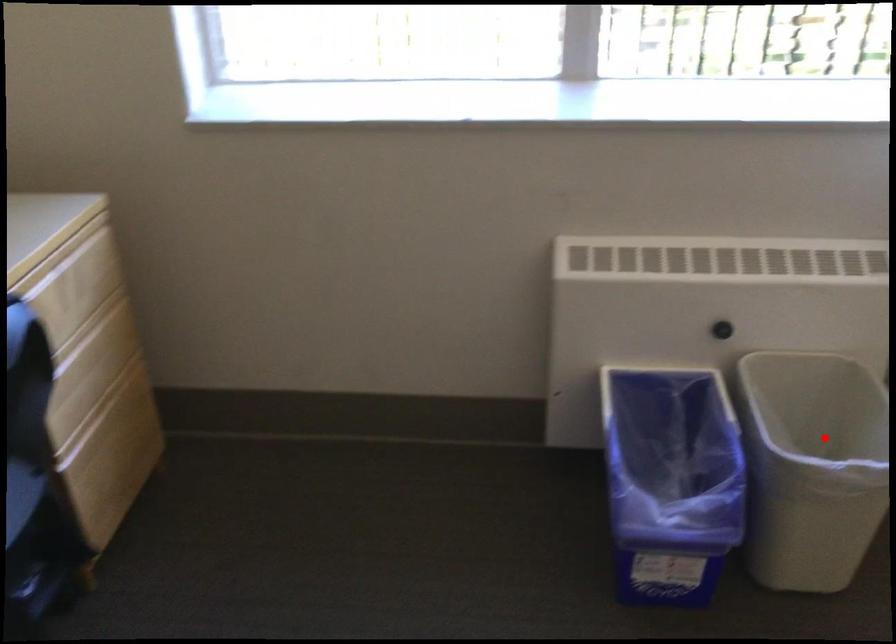
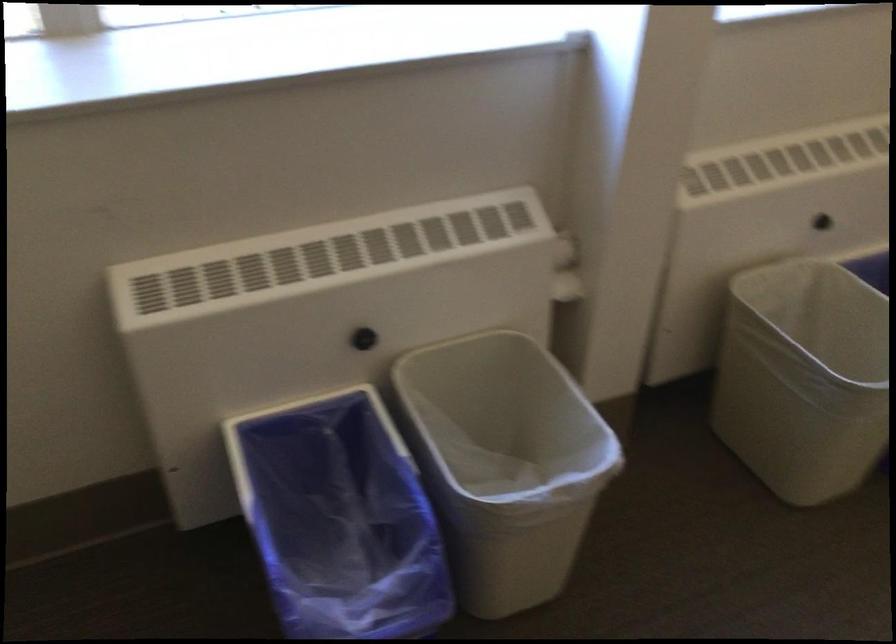
Question: A red point is marked in image1. In image2, is the corresponding 3D point closer to the camera or farther? Reply with the corresponding letter.

Choices:
 (A) The corresponding 3D point is closer.
 (B) The corresponding 3D point is farther.

Answer: (A)